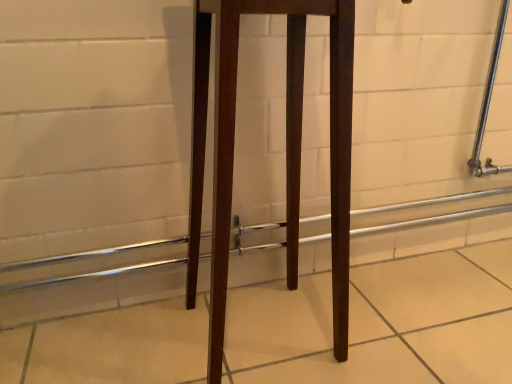
Find the location of a particular element. The width and height of the screenshot is (512, 384). vacant area that lies to the right of dark wood chair at center is located at coordinates (393, 329).